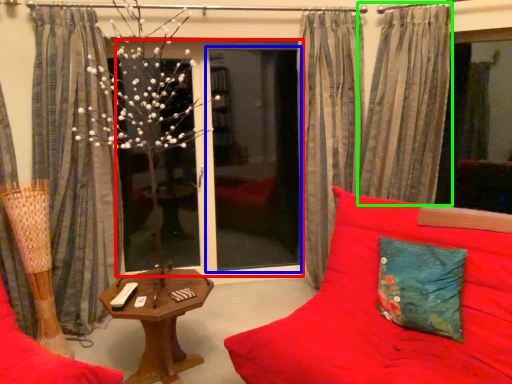
Question: Which object is the closest to the window screen (highlighted by a red box)? Choose among these: screen door (highlighted by a blue box) or curtain (highlighted by a green box).

Choices:
 (A) screen door
 (B) curtain

Answer: (A)